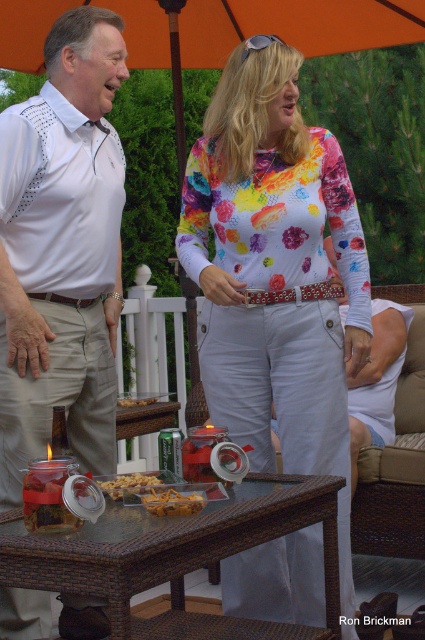
Can you confirm if translucent plastic container at center is positioned above golden crumbly snack at center?

Incorrect, translucent plastic container at center is not positioned above golden crumbly snack at center.

Between point (163, 493) and point (121, 492), which one is positioned behind?

Point (121, 492)

Between point (153, 493) and point (125, 477), which one is positioned behind?

Positioned behind is point (125, 477).

Where is `translucent plastic container at center`? translucent plastic container at center is located at coordinates (x=172, y=502).

Does floral print blouse at center have a lesser width compared to translucent plastic container at center?

In fact, floral print blouse at center might be wider than translucent plastic container at center.

Is floral print blouse at center wider than translucent plastic container at center?

Yes, floral print blouse at center is wider than translucent plastic container at center.

Between point (345, 557) and point (167, 504), which one is positioned behind?

Positioned behind is point (345, 557).

Find the location of a particular element. This screenshot has height=640, width=425. floral print blouse at center is located at coordinates (275, 275).

Who is more forward, (113, 301) or (166, 493)?

Point (166, 493)

Does white textured polo shirt at left have a smaller size compared to translucent plastic container at center?

No.

The height and width of the screenshot is (640, 425). Find the location of `white textured polo shirt at left`. white textured polo shirt at left is located at coordinates (62, 250).